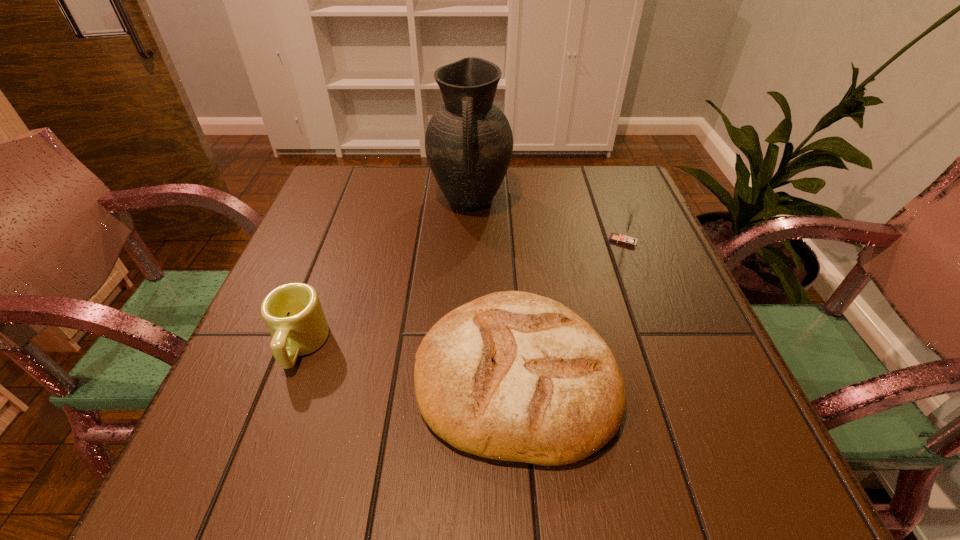
Locate an element on the screen. object that is at the far edge is located at coordinates (468, 142).

Identify the location of object present at the near edge. pos(514,376).

You are a GUI agent. You are given a task and a screenshot of the screen. Output one action in this format:
    pyautogui.click(x=<x>, y=<y>)
    Task: Click on the object that is at the left edge
    Image resolution: width=960 pixels, height=540 pixels.
    Given the screenshot: What is the action you would take?
    pyautogui.click(x=293, y=314)

Image resolution: width=960 pixels, height=540 pixels. I want to click on object that is at the right edge, so click(632, 210).

In order to click on free region at the far edge in this screenshot , I will do `click(564, 209)`.

The width and height of the screenshot is (960, 540). Find the location of `vacant area at the near edge`. vacant area at the near edge is located at coordinates (547, 476).

Locate an element on the screen. This screenshot has width=960, height=540. vacant space at the left edge of the desktop is located at coordinates [x=274, y=417].

Where is `vacant space at the right edge`? The image size is (960, 540). vacant space at the right edge is located at coordinates (623, 218).

The height and width of the screenshot is (540, 960). I want to click on free spot at the far left corner of the desktop, so click(x=362, y=173).

The width and height of the screenshot is (960, 540). I want to click on vacant point at the near left corner, so click(x=180, y=497).